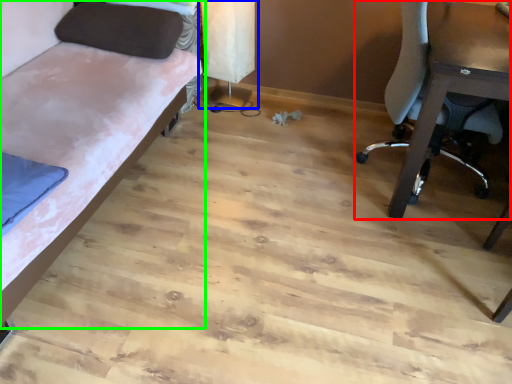
Question: Which object is the closest to the chair (highlighted by a red box)? Choose among these: table lamp (highlighted by a blue box) or studio couch (highlighted by a green box).

Choices:
 (A) table lamp
 (B) studio couch

Answer: (A)